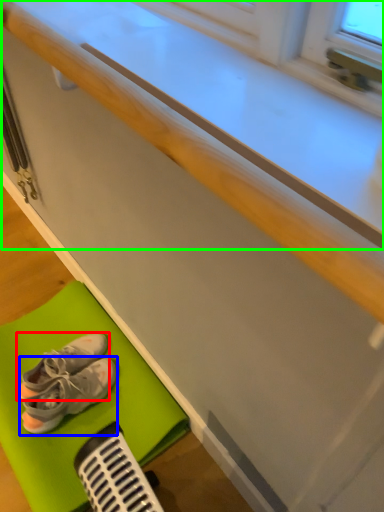
Question: Which object is positioned closest to footwear (highlighted by a red box)? Select from footwear (highlighted by a blue box) and counter top (highlighted by a green box).

Choices:
 (A) footwear
 (B) counter top

Answer: (A)